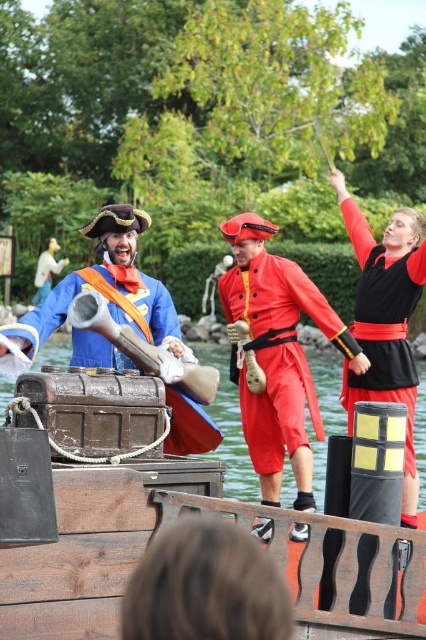
You are a spectator at this event and want to take a photo of both the shiny red uniform at center and the wooden cannon at center. Which object should you focus on first if you want to capture both in the same frame without moving the camera?

The shiny red uniform at center is below the wooden cannon at center, so you should focus on the wooden cannon at center first to ensure both are in the frame.

You are a photographer standing at the edge of the wooden stage. You want to take a picture of the black matte vest at center. Where should you position your camera to capture it best?

The black matte vest at center is located at point 0.500 on the x axis and 0.906 on the y axis, so position your camera directly facing the center of the stage to capture it best.